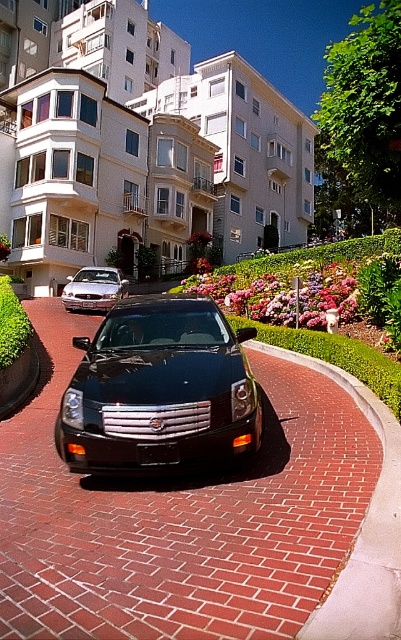
Question: Does matte silver sedan at center have a larger size compared to black plastic license plate at center?

Choices:
 (A) yes
 (B) no

Answer: (A)

Question: Which of the following is the farthest from the observer?

Choices:
 (A) (83, 301)
 (B) (360, 508)

Answer: (A)

Question: Can you confirm if glossy black car at center is smaller than black plastic license plate at center?

Choices:
 (A) no
 (B) yes

Answer: (A)

Question: Considering the real-world distances, which object is closest to the green grass at center?

Choices:
 (A) matte silver sedan at center
 (B) black glossy car at center
 (C) glossy black car at center
 (D) black plastic license plate at center

Answer: (A)

Question: Considering the real-world distances, which object is closest to the black glossy car at center?

Choices:
 (A) matte silver sedan at center
 (B) glossy black car at center
 (C) black plastic license plate at center

Answer: (B)

Question: Can you confirm if glossy black car at center is positioned to the left of black plastic license plate at center?

Choices:
 (A) yes
 (B) no

Answer: (B)